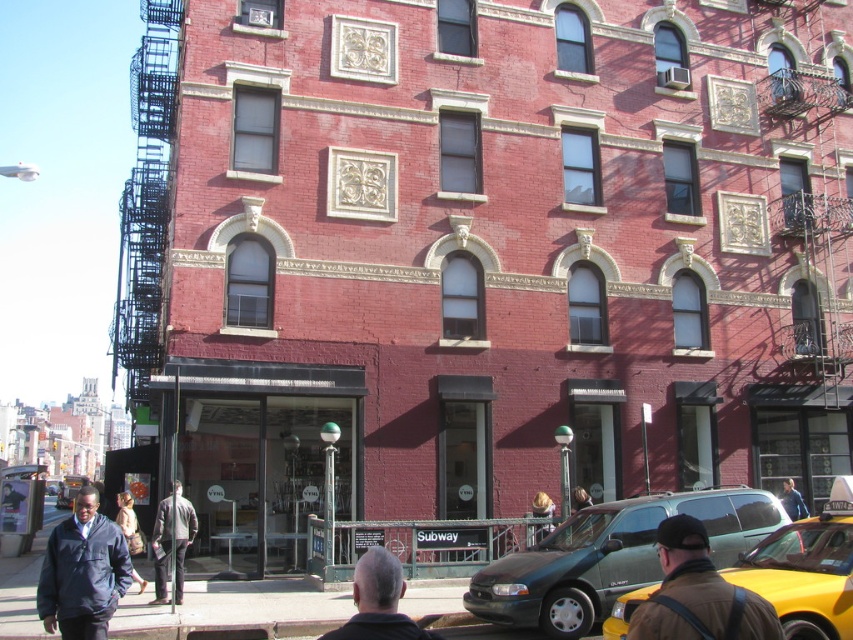
You are a pedestrian standing on the sidewalk in front of the red brick building. You want to cross the street to reach the park on the other side. Which vehicle, the green matte van at center or the yellow matte taxi at lower right, is closer to you so you can wait behind it for safety?

The green matte van at center is closer to you since it is further to the viewer than the yellow matte taxi at lower right, so you should wait behind the green matte van at center for safety.

You are a pedestrian standing at the corner of the street. You see a yellow matte taxi at lower right and a dark blue jacket at center. Which object is bigger in size?

The yellow matte taxi at lower right is larger in size than the dark blue jacket at center.

You are a photographer standing in front of the red brick building with the dark gray hair at center and dark blue jacket at center in your viewfinder. Which object should you adjust your focus on if you want to capture the one that is higher up?

The dark gray hair at center is taller than the dark blue jacket at center, so you should focus on the dark gray hair at center to capture the higher object.